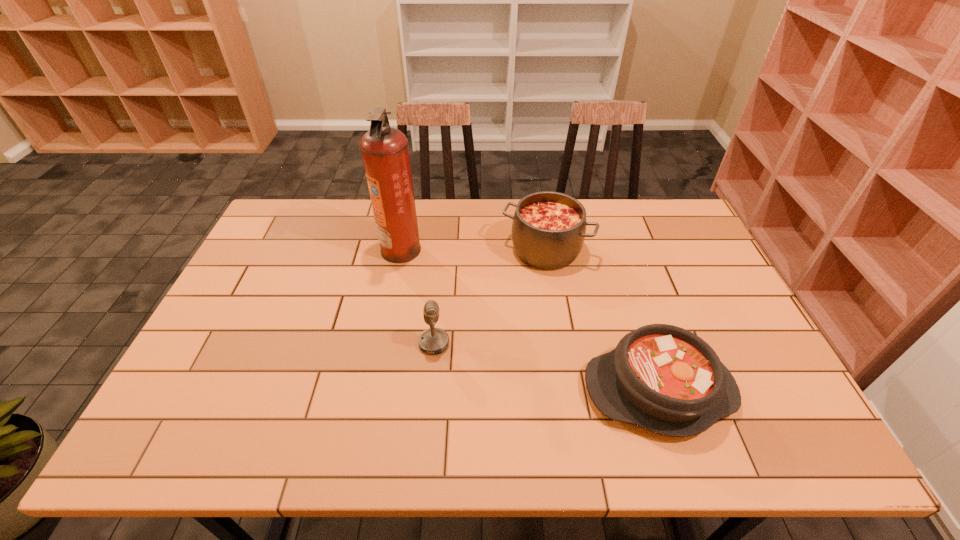
Identify the location of free space in the image that satisfies the following two spatial constraints: 1. on the front-facing side of the microphone; 2. on the back side of the nearer casserole. This screenshot has width=960, height=540. (430, 390).

Where is `blank space that satisfies the following two spatial constraints: 1. on the front-facing side of the third object from right to left; 2. on the back side of the nearer casserole`? blank space that satisfies the following two spatial constraints: 1. on the front-facing side of the third object from right to left; 2. on the back side of the nearer casserole is located at coordinates (430, 390).

Find the location of `free space that satisfies the following two spatial constraints: 1. at the nozzle of the leftmost object; 2. on the left side of the taller casserole`. free space that satisfies the following two spatial constraints: 1. at the nozzle of the leftmost object; 2. on the left side of the taller casserole is located at coordinates (401, 249).